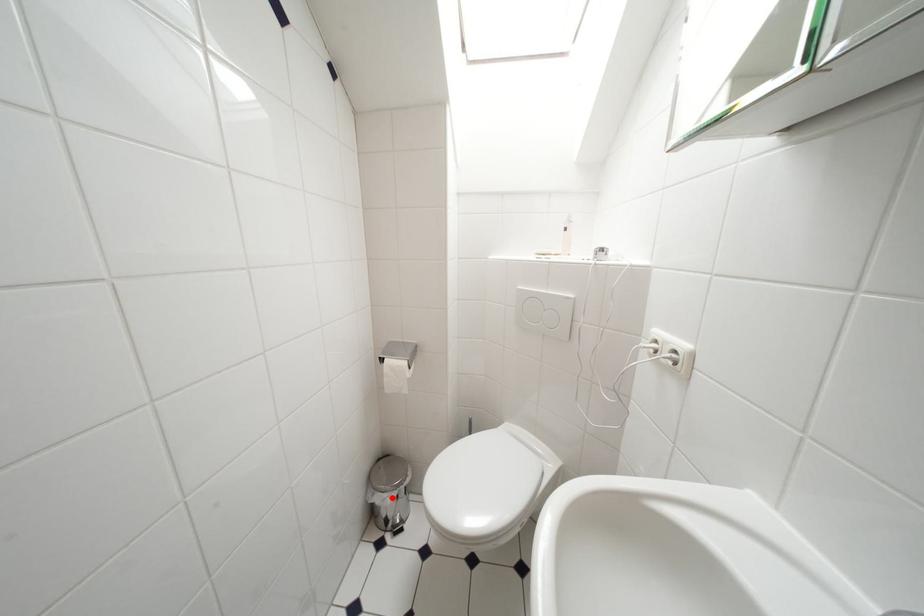
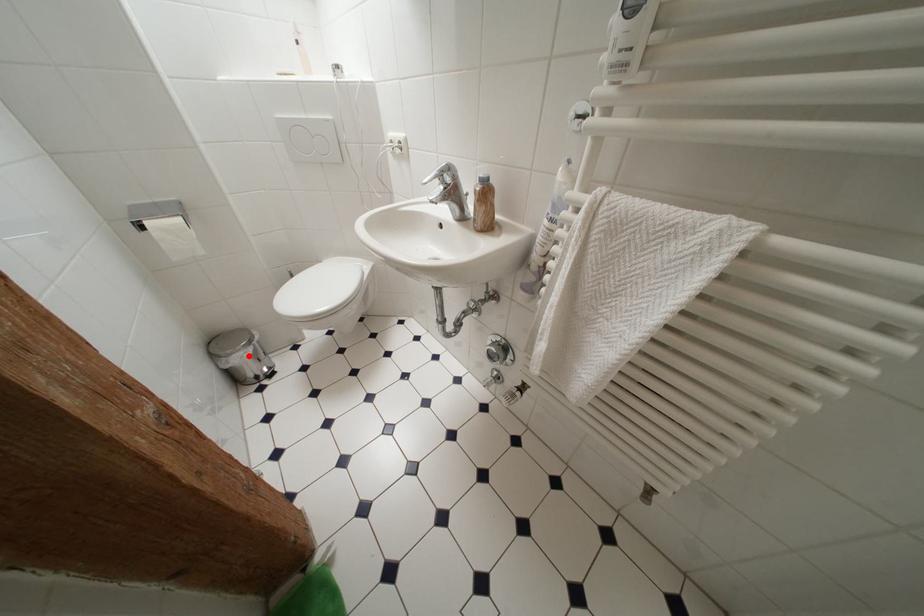
I am providing you with two images of the same scene from different viewpoints. A red point is marked on the first image and another point is marked on the second image. Do the highlighted points in image1 and image2 indicate the same real-world spot?

Yes